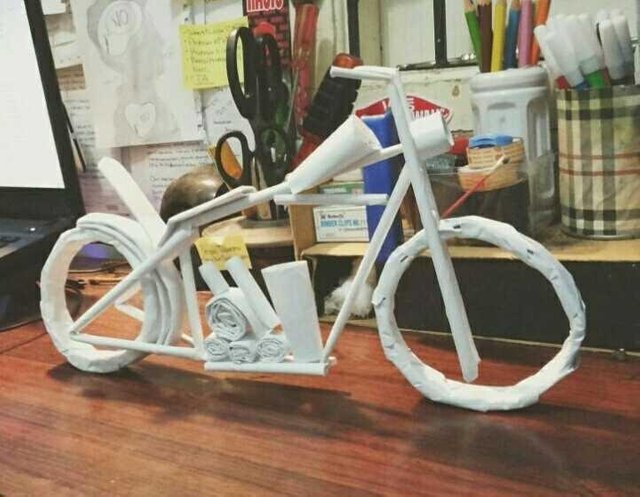
Identify the location of frame. The width and height of the screenshot is (640, 497). (356, 288).